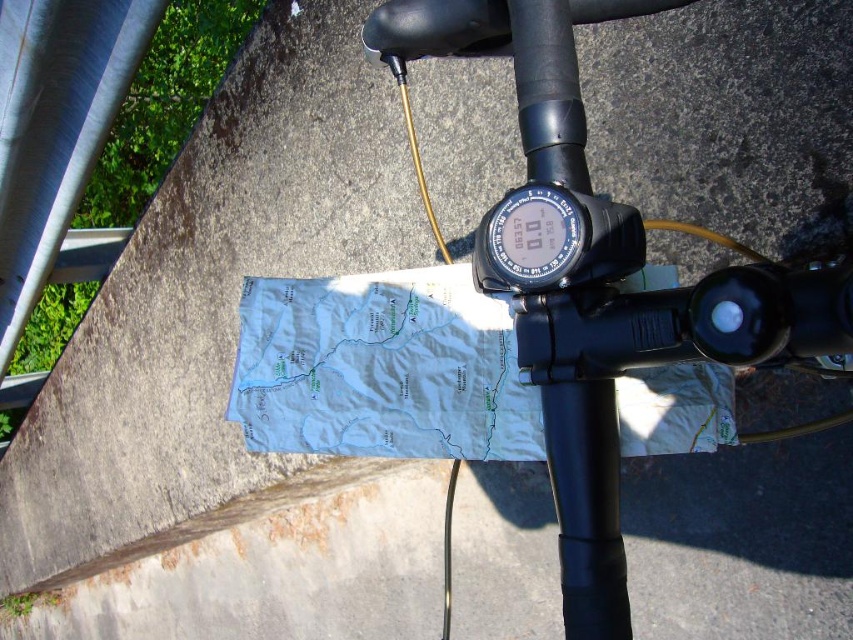
Question: In this image, where is black matte bicycle handlebar at center located relative to black plastic gauge at center?

Choices:
 (A) left
 (B) right

Answer: (B)

Question: Which of these objects is positioned closest to the black matte handlebar at center?

Choices:
 (A) black matte bicycle handlebar at center
 (B) black plastic gauge at center

Answer: (A)

Question: Can you confirm if black matte handlebar at center is positioned to the right of black plastic gauge at center?

Choices:
 (A) no
 (B) yes

Answer: (B)

Question: Which object is farther from the camera taking this photo?

Choices:
 (A) black plastic gauge at center
 (B) black matte bicycle handlebar at center

Answer: (A)

Question: Which is farther from the black plastic gauge at center?

Choices:
 (A) black matte handlebar at center
 (B) black matte bicycle handlebar at center

Answer: (B)

Question: Observing the image, what is the correct spatial positioning of black matte bicycle handlebar at center in reference to black matte handlebar at center?

Choices:
 (A) below
 (B) above

Answer: (B)